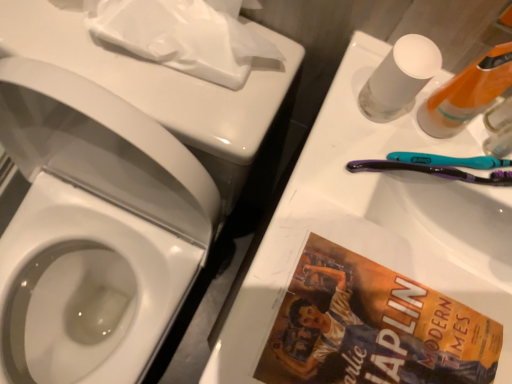
Question: From the image's perspective, is translucent plastic bottle at upper right, placed as the second mouthwash when sorted from left to right, located beneath purple plastic toothbrush at right?

Choices:
 (A) yes
 (B) no

Answer: (B)

Question: Can you confirm if translucent plastic bottle at upper right, placed as the second mouthwash when sorted from left to right, is smaller than purple plastic toothbrush at right?

Choices:
 (A) no
 (B) yes

Answer: (B)

Question: Can you confirm if translucent plastic bottle at upper right, the 1th mouthwash when ordered from right to left, is positioned to the right of purple plastic toothbrush at right?

Choices:
 (A) yes
 (B) no

Answer: (A)

Question: Is translucent plastic bottle at upper right, the 1th mouthwash when ordered from right to left, behind purple plastic toothbrush at right?

Choices:
 (A) no
 (B) yes

Answer: (A)

Question: Could you tell me if translucent plastic bottle at upper right, the 1th mouthwash when ordered from right to left, is facing purple plastic toothbrush at right?

Choices:
 (A) yes
 (B) no

Answer: (B)

Question: Considering the positions of point (499, 145) and point (395, 44), is point (499, 145) closer or farther from the camera than point (395, 44)?

Choices:
 (A) closer
 (B) farther

Answer: (B)

Question: From their relative heights in the image, would you say translucent plastic bottle at upper right, placed as the second mouthwash when sorted from left to right, is taller or shorter than transparent plastic mouthwash at upper right, which is the second mouthwash in right-to-left order?

Choices:
 (A) short
 (B) tall

Answer: (A)

Question: Which is correct: translucent plastic bottle at upper right, the 1th mouthwash when ordered from right to left, is inside transparent plastic mouthwash at upper right, marked as the 1th mouthwash in a left-to-right arrangement, or outside of it?

Choices:
 (A) inside
 (B) outside

Answer: (B)

Question: In the image, is translucent plastic bottle at upper right, placed as the second mouthwash when sorted from left to right, positioned in front of or behind transparent plastic mouthwash at upper right, marked as the 1th mouthwash in a left-to-right arrangement?

Choices:
 (A) behind
 (B) front

Answer: (A)

Question: From a real-world perspective, relative to orange plastic bottle at upper right, is translucent plastic bottle at upper right, placed as the second mouthwash when sorted from left to right, vertically above or below?

Choices:
 (A) below
 (B) above

Answer: (A)

Question: Is translucent plastic bottle at upper right, placed as the second mouthwash when sorted from left to right, in front of or behind orange plastic bottle at upper right in the image?

Choices:
 (A) behind
 (B) front

Answer: (A)

Question: Is translucent plastic bottle at upper right, the 1th mouthwash when ordered from right to left, inside or outside of orange plastic bottle at upper right?

Choices:
 (A) inside
 (B) outside

Answer: (B)

Question: From the image's perspective, is translucent plastic bottle at upper right, placed as the second mouthwash when sorted from left to right, located above or below orange plastic bottle at upper right?

Choices:
 (A) above
 (B) below

Answer: (B)

Question: Is white matte toilet paper at upper left taller or shorter than translucent plastic bottle at upper right, placed as the second mouthwash when sorted from left to right?

Choices:
 (A) tall
 (B) short

Answer: (B)

Question: Is white matte toilet paper at upper left inside or outside of translucent plastic bottle at upper right, placed as the second mouthwash when sorted from left to right?

Choices:
 (A) inside
 (B) outside

Answer: (B)